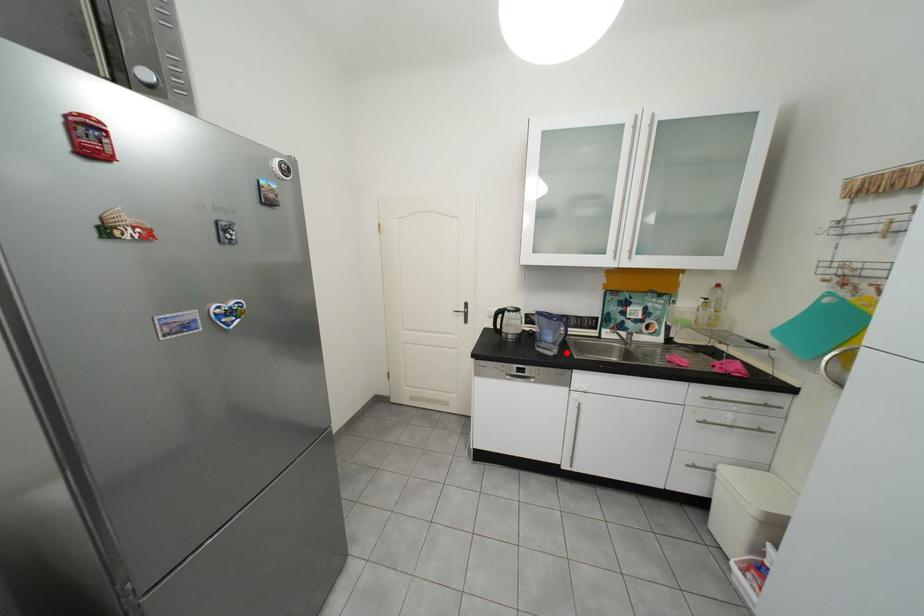
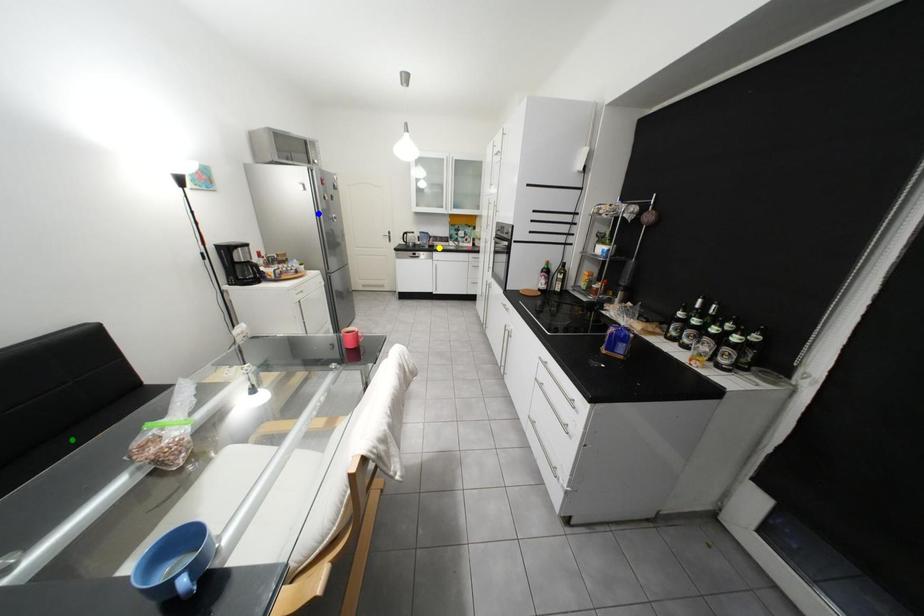
Question: I am providing you with two images of the same scene from different viewpoints. A red point is marked on the first image. You are given multiple points on the second image. Which mark in image 2 goes with the point in image 1?

Choices:
 (A) green point
 (B) blue point
 (C) yellow point

Answer: (C)